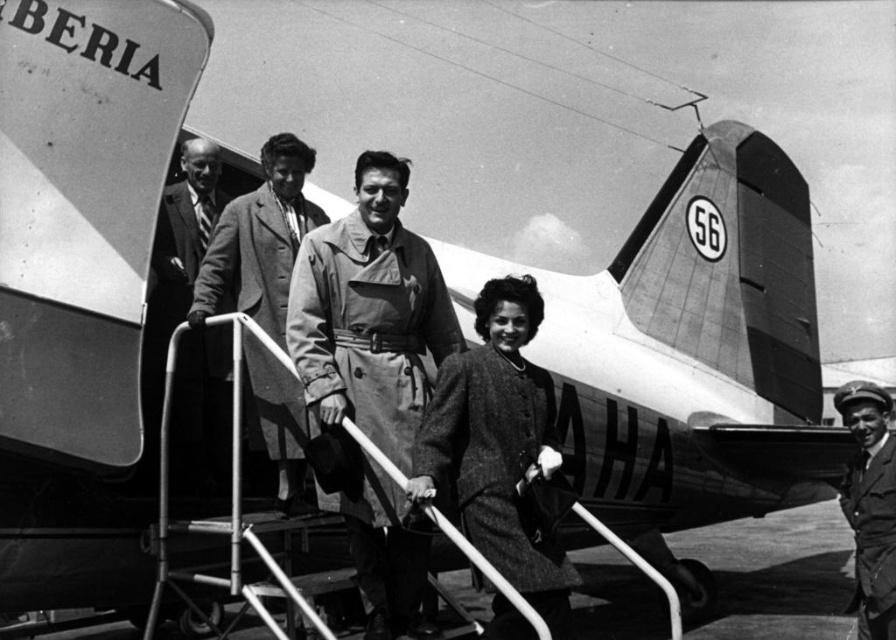
Which of these two, matte brown coat at center or smooth leather cap at lower right, stands shorter?

smooth leather cap at lower right is shorter.

Who is positioned more to the right, matte brown coat at center or smooth leather cap at lower right?

Positioned to the right is smooth leather cap at lower right.

Is point (428, 348) less distant than point (889, 554)?

Yes, it is in front of point (889, 554).

This screenshot has width=896, height=640. Find the location of `matte brown coat at center`. matte brown coat at center is located at coordinates (369, 314).

Between metallic silver ladder at center and smooth leather cap at lower right, which one appears on the right side from the viewer's perspective?

smooth leather cap at lower right

The image size is (896, 640). I want to click on metallic silver ladder at center, so click(230, 500).

Does matte brown coat at center have a greater height compared to light brown leather coat at center?

Indeed, matte brown coat at center has a greater height compared to light brown leather coat at center.

Does matte brown coat at center have a greater width compared to light brown leather coat at center?

Indeed, matte brown coat at center has a greater width compared to light brown leather coat at center.

Where is `matte brown coat at center`? The width and height of the screenshot is (896, 640). matte brown coat at center is located at coordinates (369, 314).